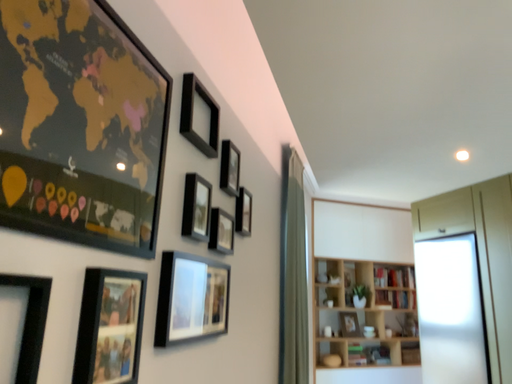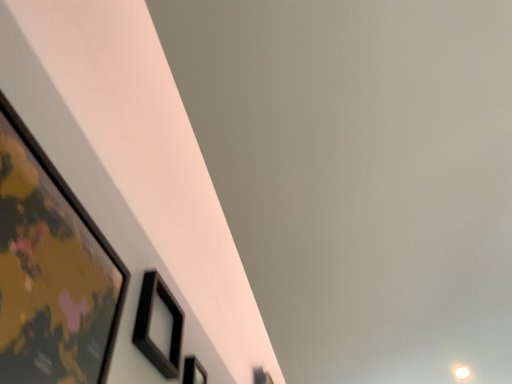
Question: Which way did the camera rotate in the video?

Choices:
 (A) rotated upward
 (B) rotated downward

Answer: (A)